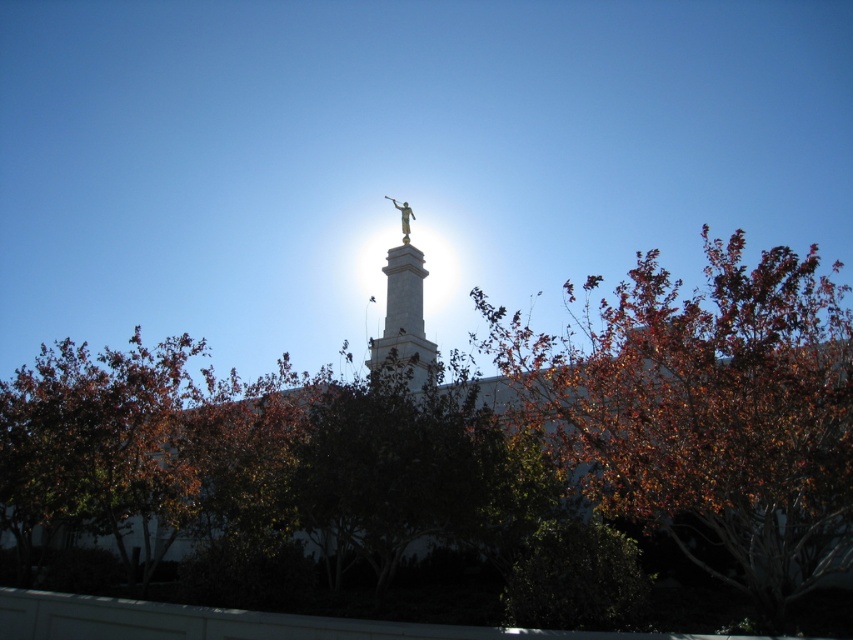
Between point (738, 234) and point (397, 205), which one is positioned in front?

Positioned in front is point (738, 234).

Does autumn leaves at upper center appear on the right side of gold metallic statue at upper center?

Indeed, autumn leaves at upper center is positioned on the right side of gold metallic statue at upper center.

In order to click on autumn leaves at upper center in this screenshot , I will do `click(706, 412)`.

I want to click on autumn leaves at upper center, so click(706, 412).

Does gold polished statue at center have a larger size compared to gold metallic statue at upper center?

Indeed, gold polished statue at center has a larger size compared to gold metallic statue at upper center.

Is point (389, 310) positioned before point (392, 198)?

Yes.

What are the coordinates of `gold polished statue at center` in the screenshot? It's located at (403, 312).

Who is more forward, (717, 384) or (396, 266)?

Point (717, 384)

Locate an element on the screen. autumn leaves at upper center is located at coordinates (706, 412).